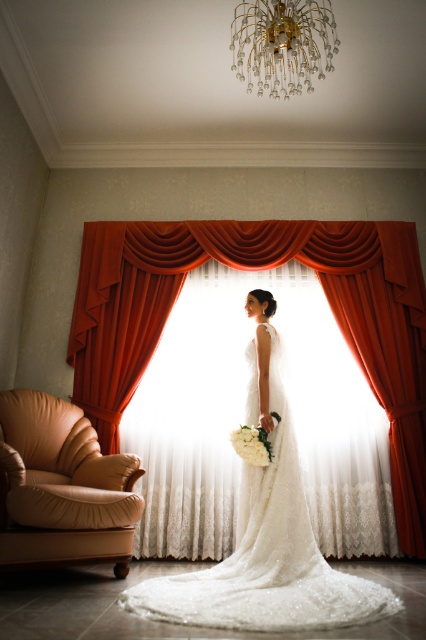
Question: Can you confirm if tan leather armchair at lower left is wider than gold crystal chandelier at upper center?

Choices:
 (A) yes
 (B) no

Answer: (A)

Question: Can you confirm if matte orange curtain at center is positioned above white lace dress at center?

Choices:
 (A) yes
 (B) no

Answer: (A)

Question: Which of the following is the farthest from the observer?

Choices:
 (A) (252, 440)
 (B) (275, 48)
 (C) (118, 278)
 (D) (108, 550)

Answer: (C)

Question: Is gold crystal chandelier at upper center above white floral bouquet at center?

Choices:
 (A) yes
 (B) no

Answer: (A)

Question: Which point is farther from the camera taking this photo?

Choices:
 (A) (294, 444)
 (B) (264, 461)
 (C) (258, 4)

Answer: (C)

Question: Among these objects, which one is farthest from the camera?

Choices:
 (A) white floral bouquet at center
 (B) tan leather armchair at lower left
 (C) gold crystal chandelier at upper center

Answer: (A)